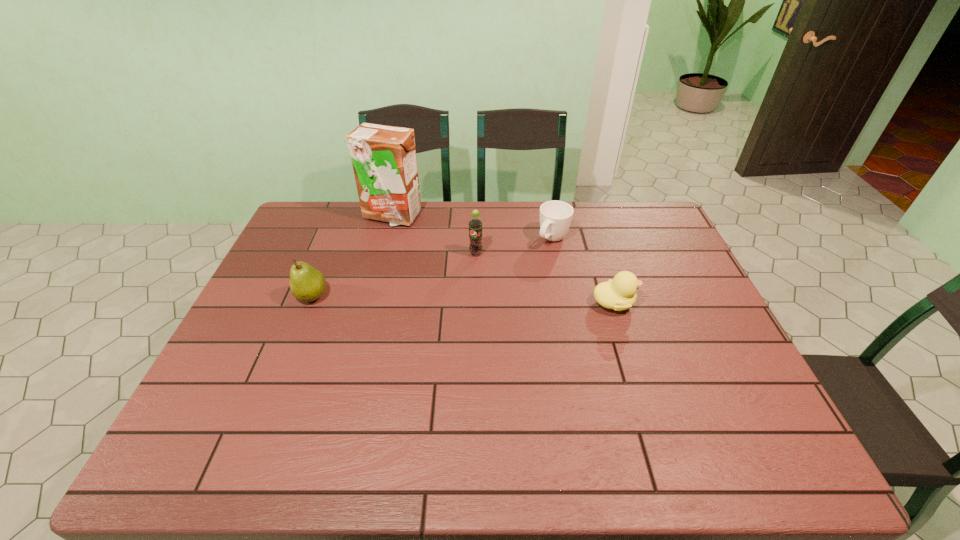
The image size is (960, 540). Identify the location of blank area located 0.230m with the handle on the side of the second object from right to left. pos(511,292).

Identify the location of free region located 0.260m with the handle on the side of the second object from right to left. (506, 298).

The image size is (960, 540). I want to click on free space located 0.130m with the handle on the side of the second object from right to left, so click(527, 273).

This screenshot has width=960, height=540. I want to click on vacant region located 0.300m on the front label of the third object from left to right, so click(431, 323).

The height and width of the screenshot is (540, 960). Find the location of `free space located on the front label of the third object from left to right`. free space located on the front label of the third object from left to right is located at coordinates pos(423,333).

Identify the location of free region located 0.160m on the front label of the third object from left to right. (452, 290).

The height and width of the screenshot is (540, 960). Identify the location of vacant space positioned 0.180m on the straw side of the second object from left to right. (420, 258).

This screenshot has width=960, height=540. In order to click on vacant space situated 0.170m on the straw side of the second object from left to right in this screenshot , I will do `click(419, 256)`.

The height and width of the screenshot is (540, 960). What are the coordinates of `vacant space situated on the straw side of the second object from left to right` in the screenshot? It's located at (437, 289).

Where is `cup located in the far edge section of the desktop`? The height and width of the screenshot is (540, 960). cup located in the far edge section of the desktop is located at coordinates (555, 216).